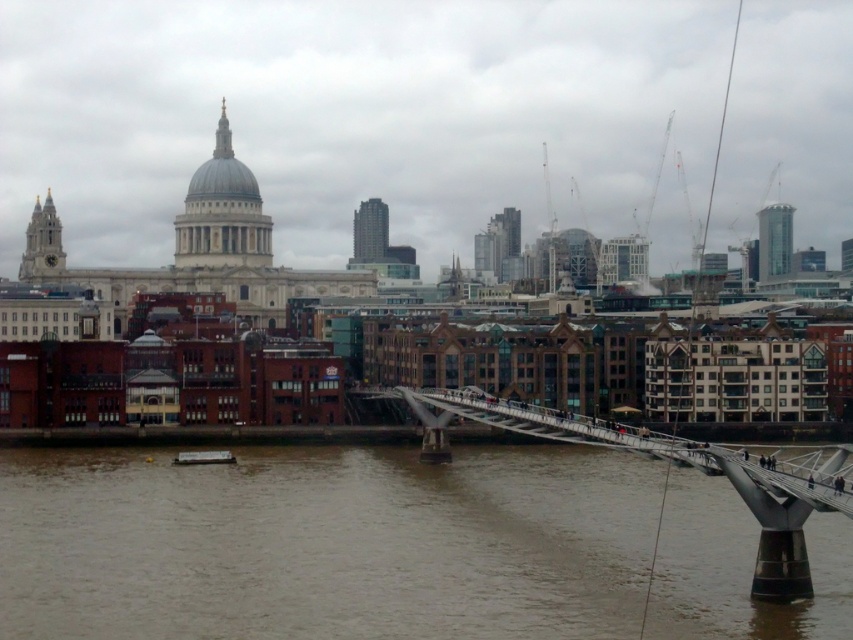
You are a city planner assessing the riverfront area. You need to determine if a new floating platform, which is 20 meters wide, can be placed in the river between the brown murky water at center and the metallic silver bridge at center. Based on the scene, can the platform fit?

The brown murky water at center is wider than the metallic silver bridge at center. Since the platform is 20 meters wide, it can fit within the river area where the water is wider than the bridge.

You are standing at the point marked as point (526, 564) in the cityscape. You want to take a photo of the dome of St. Paul Cathedral. Is the dome visible from your current position?

The dome of St. Paul Cathedral is visible from point (526, 564) because the distance of point (526, 564) from viewer is 84.73 meters, which is within a reasonable viewing distance.

You are a tourist standing on the Millennium Bridge and want to take a photo of the brown murky water at center and the metallic silver bridge at center. Which object will appear larger in the photo?

The metallic silver bridge at center will appear larger in the photo because it is taller than the brown murky water at center.